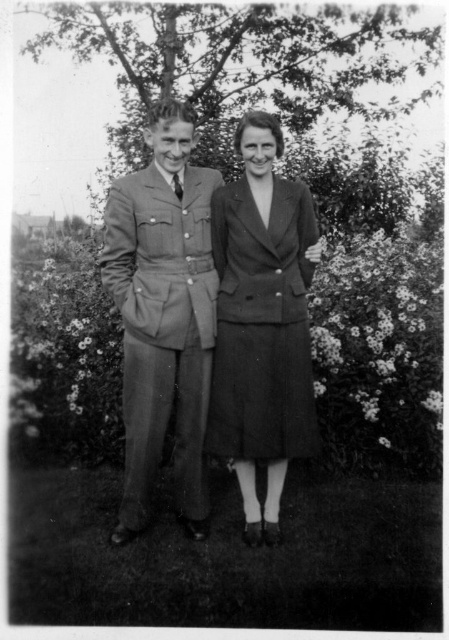
You are a tailor observing two suits displayed side by side in a store window. The suits are labeled as the matte gray suit at center and the gray woolen suit at center. From the perspective of a customer standing in front of the window, which suit is positioned higher?

Answer: The matte gray suit at center is positioned higher than the gray woolen suit at center.

Looking at this image, you are a tailor observing two suits displayed at the center of a boutique window. The matte gray suit at center and the gray woolen suit at center are both on display. Which one is taller?

The matte gray suit at center has a greater height compared to the gray woolen suit at center.

You are a photographer adjusting the focus of your camera. You want to ensure both the matte gray suit at center and the textured wool dress at center are in focus. Given that your camera has a depth of field range of 10 inches, will both subjects be in focus?

The matte gray suit at center is 11.72 inches away from the textured wool dress at center. Since the distance between them exceeds the camera lens depth of field range of 10 inches, the camera cannot keep both in focus simultaneously. You will need to adjust the focus or use a different lens setting to accommodate the distance.